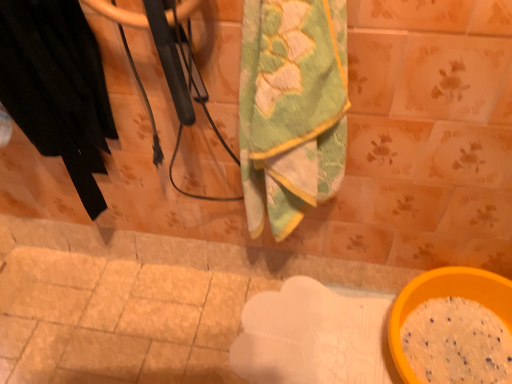
Question: Can you confirm if yellow plastic bowl at lower right is shorter than green textured towel at center?

Choices:
 (A) no
 (B) yes

Answer: (B)

Question: From a real-world perspective, is yellow plastic bowl at lower right beneath green textured towel at center?

Choices:
 (A) no
 (B) yes

Answer: (B)

Question: Is yellow plastic bowl at lower right positioned in front of green textured towel at center?

Choices:
 (A) yes
 (B) no

Answer: (B)

Question: Considering the relative sizes of yellow plastic bowl at lower right and green textured towel at center in the image provided, is yellow plastic bowl at lower right taller than green textured towel at center?

Choices:
 (A) no
 (B) yes

Answer: (A)

Question: From the image's perspective, is yellow plastic bowl at lower right over green textured towel at center?

Choices:
 (A) no
 (B) yes

Answer: (A)

Question: From a real-world perspective, relative to black fabric at left, is yellow plastic bowl at lower right vertically above or below?

Choices:
 (A) above
 (B) below

Answer: (B)

Question: Based on their sizes in the image, would you say yellow plastic bowl at lower right is bigger or smaller than black fabric at left?

Choices:
 (A) big
 (B) small

Answer: (B)

Question: Considering their positions, is yellow plastic bowl at lower right located in front of or behind black fabric at left?

Choices:
 (A) behind
 (B) front

Answer: (A)

Question: From the image's perspective, is yellow plastic bowl at lower right located above or below black fabric at left?

Choices:
 (A) below
 (B) above

Answer: (A)

Question: Is yellow plastic bowl at lower right taller or shorter than green textured towel at center?

Choices:
 (A) tall
 (B) short

Answer: (B)

Question: Is yellow plastic bowl at lower right spatially inside green textured towel at center, or outside of it?

Choices:
 (A) outside
 (B) inside

Answer: (A)

Question: From a real-world perspective, relative to green textured towel at center, is yellow plastic bowl at lower right vertically above or below?

Choices:
 (A) below
 (B) above

Answer: (A)

Question: Is yellow plastic bowl at lower right wider or thinner than green textured towel at center?

Choices:
 (A) thin
 (B) wide

Answer: (B)

Question: In the image, is green textured towel at center positioned in front of or behind black fabric at left?

Choices:
 (A) behind
 (B) front

Answer: (B)

Question: Visually, is green textured towel at center positioned to the left or to the right of black fabric at left?

Choices:
 (A) right
 (B) left

Answer: (A)